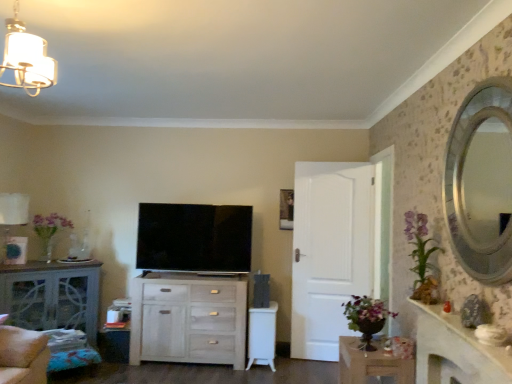
Question: From a real-world perspective, is matte gray cabinet at left, the first table when ordered from back to front, positioned above or below white matte door at center?

Choices:
 (A) above
 (B) below

Answer: (B)

Question: Choose the correct answer: Is matte gray cabinet at left, which ranks as the 1th table in left-to-right order, inside white matte door at center or outside it?

Choices:
 (A) inside
 (B) outside

Answer: (B)

Question: Estimate the real-world distances between objects in this image. Which object is closer to the matte gray cabinet at left, which ranks as the 1th table in left-to-right order?

Choices:
 (A) translucent glass vase at left, arranged as the 1th floral arrangement when viewed from the left
 (B) white marble fireplace at right
 (C) white glass chandelier at upper left, the second lamp when ordered from left to right
 (D) white fabric lampshade at left, which is counted as the second lamp, starting from the top
 (E) flat screen tv at center

Answer: (A)

Question: Considering the real-world distances, which object is closest to the white matte door at center?

Choices:
 (A) flat screen tv at center
 (B) wooden table at lower right, which appears as the 2th table when viewed from the back
 (C) matte gray cabinet at left, the first table when ordered from back to front
 (D) white glass chandelier at upper left, marked as the 1th lamp in a right-to-left arrangement
 (E) white marble fireplace at right

Answer: (A)